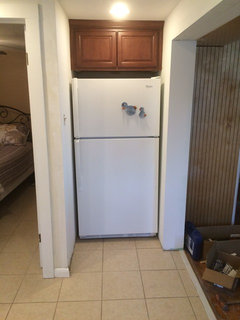
Locate an element on the screen. headboard is located at coordinates (9, 115).